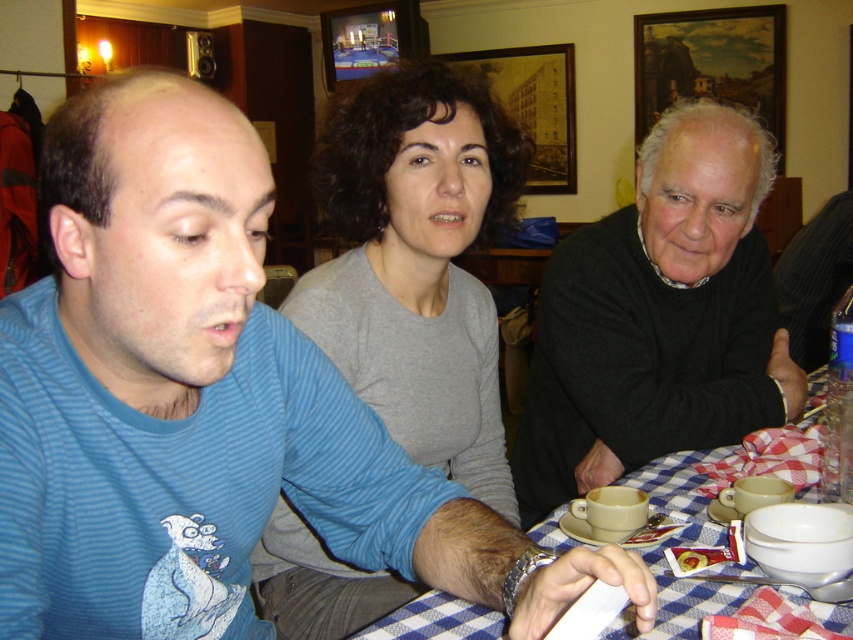
Which is more to the right, gray matte shirt at center or black wool sweater at right?

black wool sweater at right

At what (x,y) coordinates should I click in order to perform the action: click on gray matte shirt at center. Please return your answer as a coordinate pair (x, y). The image size is (853, 640). Looking at the image, I should click on (416, 262).

Does black wool sweater at right appear on the left side of blue checkered tablecloth at lower center?

Indeed, black wool sweater at right is positioned on the left side of blue checkered tablecloth at lower center.

Does point (560, 490) come behind point (610, 625)?

Yes, it is.

Where is `black wool sweater at right`? black wool sweater at right is located at coordinates (659, 316).

Who is more distant from viewer, (311,468) or (747,266)?

Point (747,266)

Who is positioned more to the left, blue striped shirt at left or black wool sweater at right?

Positioned to the left is blue striped shirt at left.

Describe the element at coordinates (202, 404) in the screenshot. I see `blue striped shirt at left` at that location.

This screenshot has height=640, width=853. I want to click on blue striped shirt at left, so click(202, 404).